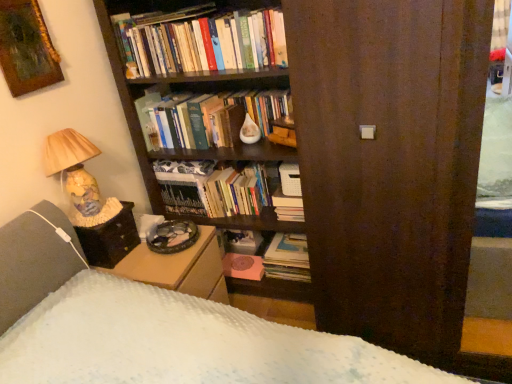
Question: Is hardcover books at upper center, the 4th book in the bottom-to-top sequence, looking in the opposite direction of matte paper stack of books at center, the fourth book when ordered from top to bottom?

Choices:
 (A) no
 (B) yes

Answer: (A)

Question: Does hardcover books at upper center, the first book positioned from the top, appear on the left side of matte paper stack of books at center, the fourth book when ordered from top to bottom?

Choices:
 (A) yes
 (B) no

Answer: (A)

Question: From a real-world perspective, is hardcover books at upper center, the first book positioned from the top, physically above matte paper stack of books at center, the fourth book when ordered from top to bottom?

Choices:
 (A) yes
 (B) no

Answer: (A)

Question: From the image's perspective, is hardcover books at upper center, the first book positioned from the top, under matte paper stack of books at center, marked as the 1th book in a bottom-to-top arrangement?

Choices:
 (A) no
 (B) yes

Answer: (A)

Question: From the image's perspective, does hardcover books at upper center, the 4th book in the bottom-to-top sequence, appear higher than matte paper stack of books at center, the fourth book when ordered from top to bottom?

Choices:
 (A) yes
 (B) no

Answer: (A)

Question: Is the position of hardcover books at upper center, the 4th book in the bottom-to-top sequence, more distant than that of matte paper stack of books at center, marked as the 1th book in a bottom-to-top arrangement?

Choices:
 (A) no
 (B) yes

Answer: (A)

Question: From a real-world perspective, is brown wood screen door at center positioned over matte paper stack of books at center, the fourth book when ordered from top to bottom, based on gravity?

Choices:
 (A) no
 (B) yes

Answer: (B)

Question: Is brown wood screen door at center behind matte paper stack of books at center, marked as the 1th book in a bottom-to-top arrangement?

Choices:
 (A) no
 (B) yes

Answer: (A)

Question: From the image's perspective, would you say brown wood screen door at center is shown under matte paper stack of books at center, marked as the 1th book in a bottom-to-top arrangement?

Choices:
 (A) no
 (B) yes

Answer: (A)

Question: From the image's perspective, is brown wood screen door at center over matte paper stack of books at center, marked as the 1th book in a bottom-to-top arrangement?

Choices:
 (A) yes
 (B) no

Answer: (A)

Question: Is brown wood screen door at center wider than matte paper stack of books at center, the fourth book when ordered from top to bottom?

Choices:
 (A) no
 (B) yes

Answer: (A)

Question: Considering the relative sizes of brown wood screen door at center and matte paper stack of books at center, marked as the 1th book in a bottom-to-top arrangement, in the image provided, is brown wood screen door at center shorter than matte paper stack of books at center, marked as the 1th book in a bottom-to-top arrangement,?

Choices:
 (A) yes
 (B) no

Answer: (B)

Question: From a real-world perspective, is matte paper stack of books at center, marked as the 1th book in a bottom-to-top arrangement, under hardcover book at center, marked as the second book in a top-to-bottom arrangement?

Choices:
 (A) yes
 (B) no

Answer: (A)